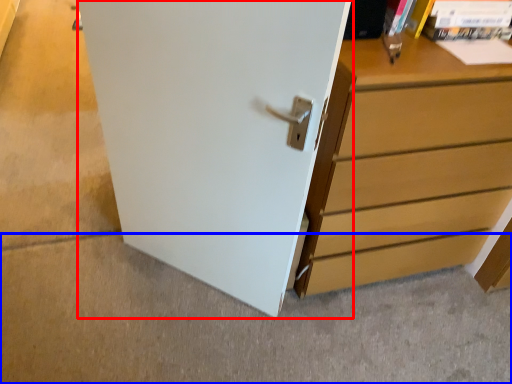
Question: Among these objects, which one is farthest to the camera, door (highlighted by a red box) or concrete (highlighted by a blue box)?

Choices:
 (A) door
 (B) concrete

Answer: (B)